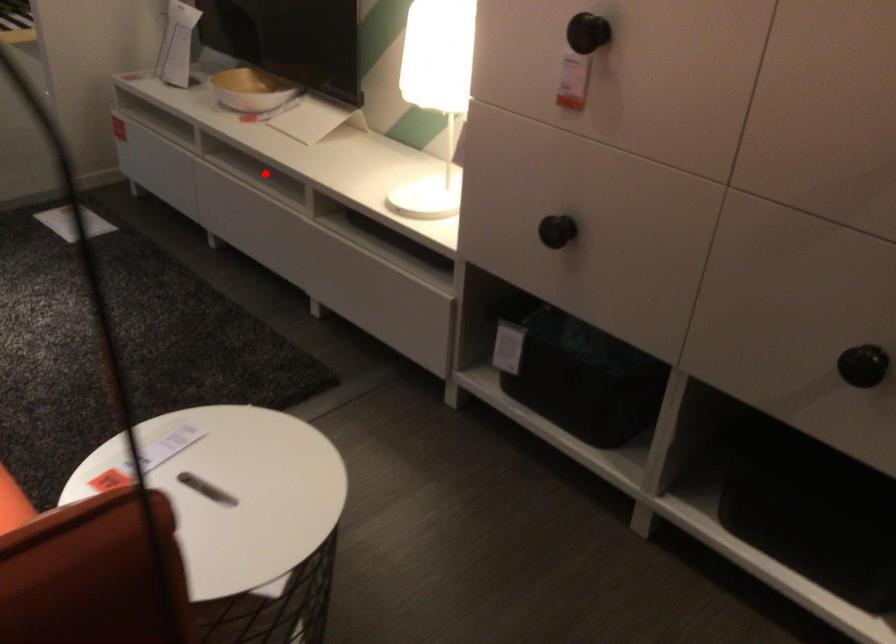
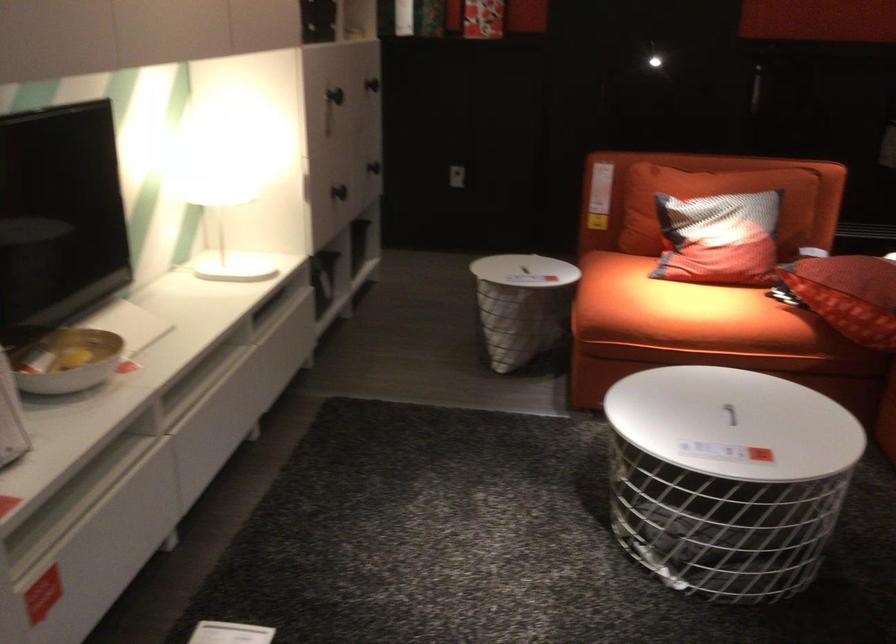
The point at the highlighted location is marked in the first image. Where is the corresponding point in the second image?

(200, 381)